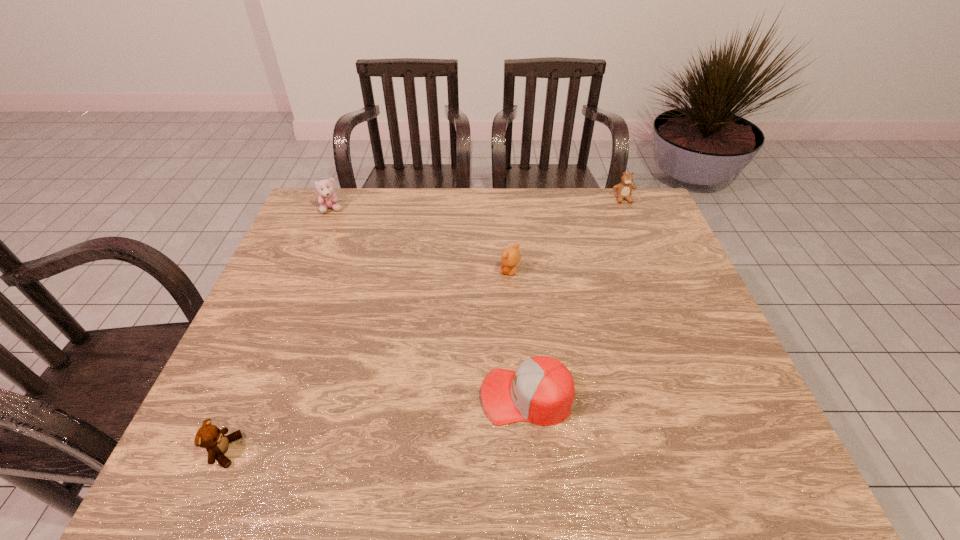
You are a GUI agent. You are given a task and a screenshot of the screen. Output one action in this format:
    pyautogui.click(x=<x>, y=<y>)
    Task: Click on the vacant space that satisfies the following two spatial constraints: 1. on the front-facing side of the rightmost object; 2. on the front-facing side of the nearest teddy bear
    Image resolution: width=960 pixels, height=540 pixels.
    Given the screenshot: What is the action you would take?
    pyautogui.click(x=727, y=451)

Where is `free location that satisfies the following two spatial constraints: 1. on the front-facing side of the rightmost object; 2. on the face of the third farthest object`? free location that satisfies the following two spatial constraints: 1. on the front-facing side of the rightmost object; 2. on the face of the third farthest object is located at coordinates (654, 272).

Locate an element on the screen. The height and width of the screenshot is (540, 960). vacant space that satisfies the following two spatial constraints: 1. on the front-facing side of the rightmost object; 2. on the front-facing side of the fourth farthest object is located at coordinates (705, 396).

In order to click on free space that satisfies the following two spatial constraints: 1. on the front-facing side of the rightmost object; 2. on the front-facing side of the baseball cap in this screenshot , I will do `click(705, 396)`.